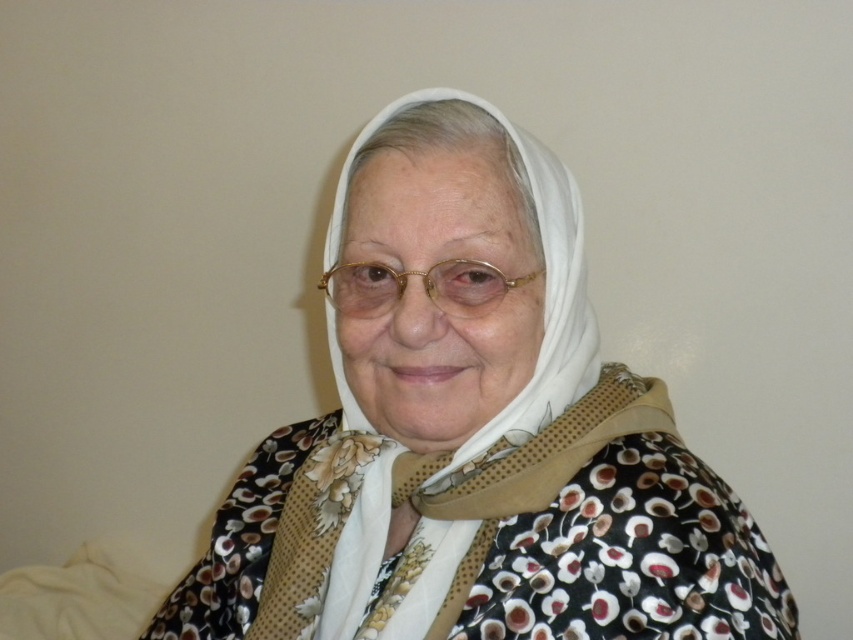
Between point (523, 240) and point (399, 289), which one is positioned behind?

Point (523, 240)

Who is more distant from viewer, (514, 275) or (503, 284)?

Point (514, 275)

You are a GUI agent. You are given a task and a screenshot of the screen. Output one action in this format:
    pyautogui.click(x=<x>, y=<y>)
    Task: Click on the white fabric headscarf at center
    The width and height of the screenshot is (853, 640).
    Given the screenshot: What is the action you would take?
    pyautogui.click(x=476, y=438)